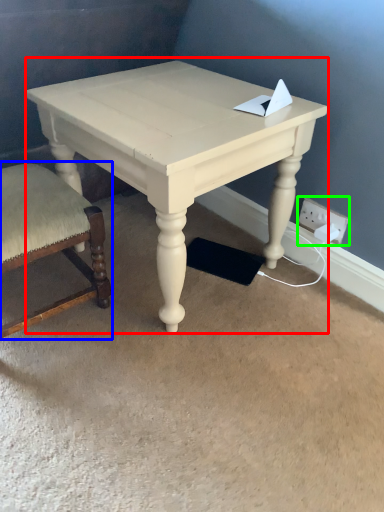
Question: Which is nearer to the table (highlighted by a red box)? chair (highlighted by a blue box) or electric outlet (highlighted by a green box).

Choices:
 (A) chair
 (B) electric outlet

Answer: (A)